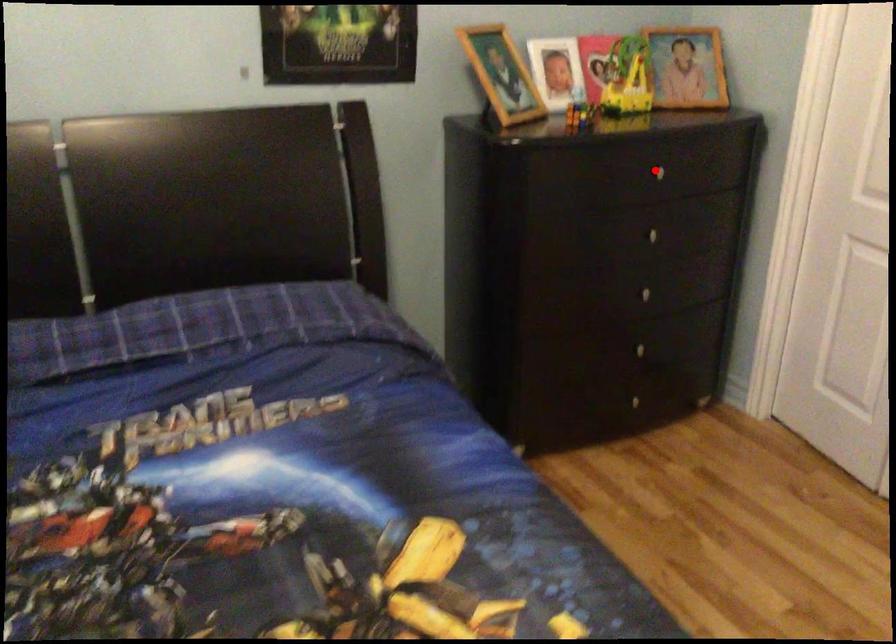
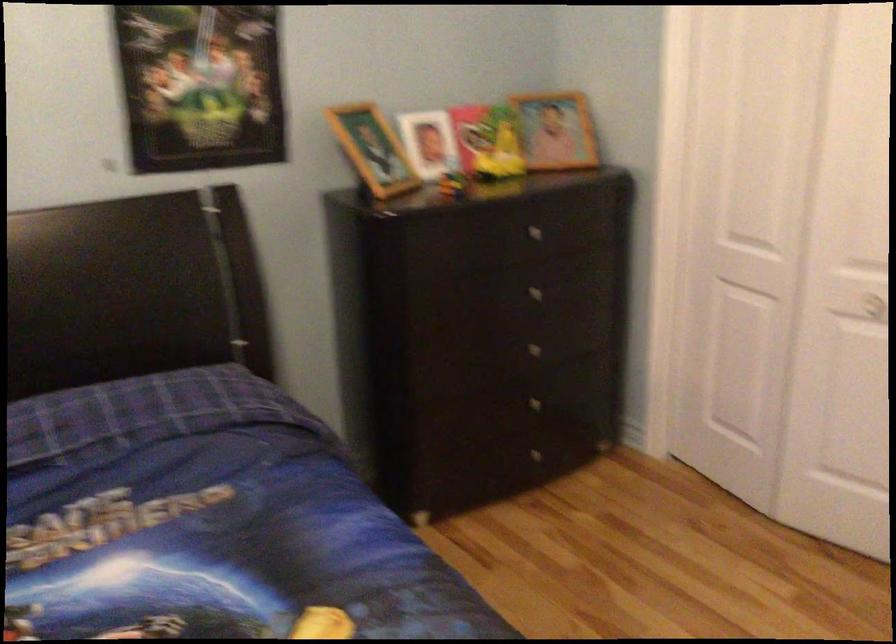
The point at the highlighted location is marked in the first image. Where is the corresponding point in the second image?

(530, 230)